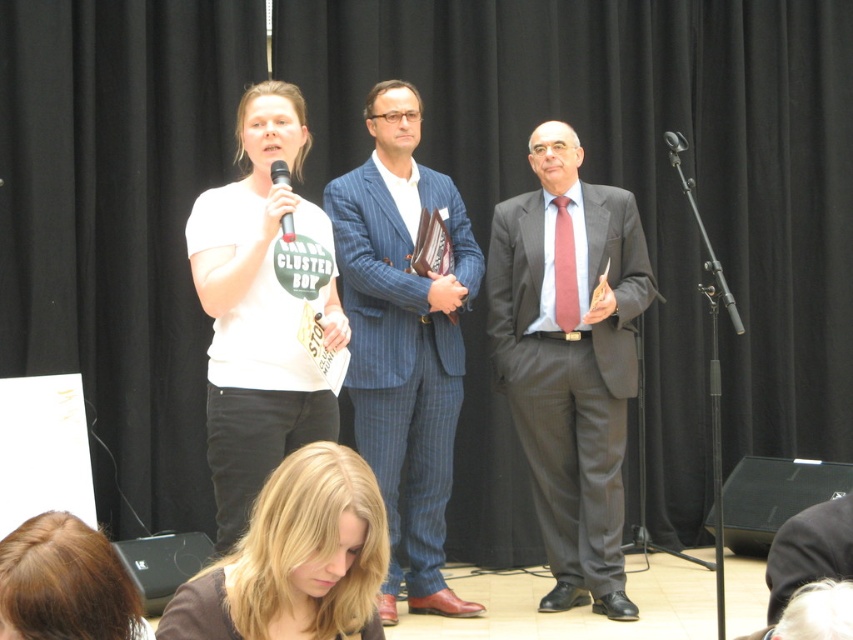
Question: Does blonde hair at lower center appear under blonde hair at lower left?

Choices:
 (A) no
 (B) yes

Answer: (B)

Question: Which object is closer to the camera taking this photo?

Choices:
 (A) metallic silver microphone at upper center
 (B) black plastic microphone at upper center
 (C) blue pinstripe suit at center
 (D) dark gray wool suit at center

Answer: (D)

Question: Does matte gray suit at center have a smaller size compared to metallic silver microphone at upper center?

Choices:
 (A) no
 (B) yes

Answer: (A)

Question: Among these objects, which one is nearest to the camera?

Choices:
 (A) blue pinstripe suit at center
 (B) blonde hair at lower left

Answer: (B)

Question: Which of these objects is positioned farthest from the blue pinstripe suit at center?

Choices:
 (A) dark gray wool suit at center
 (B) blonde hair at lower left
 (C) white matte t-shirt at upper left
 (D) matte gray suit at center

Answer: (B)

Question: From the image, what is the correct spatial relationship of white matte t-shirt at upper left in relation to blonde hair at lower center?

Choices:
 (A) left
 (B) right

Answer: (A)